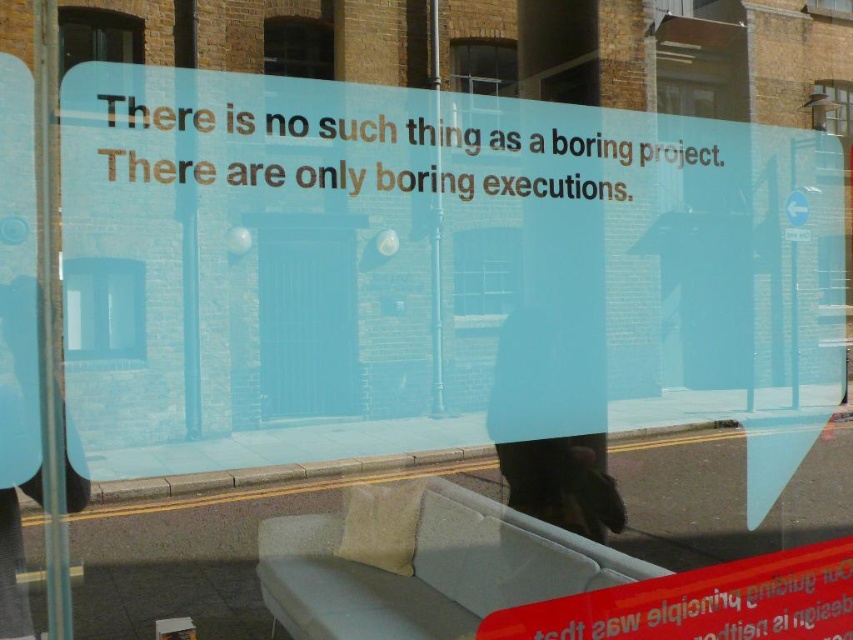
You are a delivery person with a package that is 7 feet long. You need to deliver it through the clear glass window at center. Can you fit the package through the window?

The clear glass window at center is 6.88 feet in length, so the package is longer than the window. Therefore, the package cannot fit through the window.

You are an architect reviewing a building design. You notice the matte glass window at upper center and the transparent glass window at upper center. Which of these two windows has a larger surface area?

The transparent glass window at upper center has a larger surface area than the matte glass window at upper center because the matte glass window at upper center is smaller than transparent glass window at upper center.

You are an architect designing a new building. You have two types of glass windows available for the facade. The matte glass window at upper center and the transparent glass window at upper center. Which of these two windows is narrower in width?

The matte glass window at upper center is narrower in width than the transparent glass window at upper center.